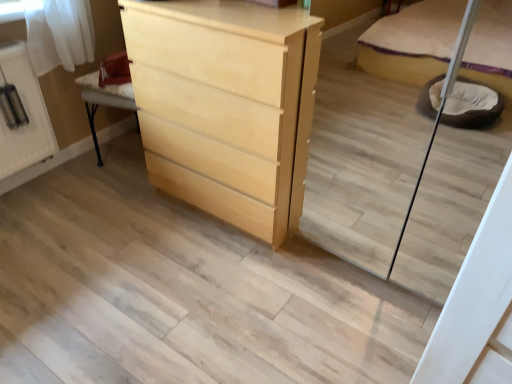
Question: Is white glossy cabinet at upper left looking in the opposite direction of light wood/finish chest of drawers at center?

Choices:
 (A) no
 (B) yes

Answer: (A)

Question: Can you confirm if white glossy cabinet at upper left is taller than light wood/finish chest of drawers at center?

Choices:
 (A) no
 (B) yes

Answer: (A)

Question: Considering the relative positions of white glossy cabinet at upper left and light wood/finish chest of drawers at center in the image provided, is white glossy cabinet at upper left to the left of light wood/finish chest of drawers at center from the viewer's perspective?

Choices:
 (A) no
 (B) yes

Answer: (B)

Question: Is white glossy cabinet at upper left to the right of light wood/finish chest of drawers at center from the viewer's perspective?

Choices:
 (A) yes
 (B) no

Answer: (B)

Question: Does white glossy cabinet at upper left have a lesser width compared to light wood/finish chest of drawers at center?

Choices:
 (A) yes
 (B) no

Answer: (A)

Question: Could you tell me if white glossy cabinet at upper left is turned towards light wood/finish chest of drawers at center?

Choices:
 (A) no
 (B) yes

Answer: (A)

Question: Considering the relative sizes of light wood/finish chest of drawers at center and white glossy cabinet at upper left in the image provided, is light wood/finish chest of drawers at center wider than white glossy cabinet at upper left?

Choices:
 (A) no
 (B) yes

Answer: (B)

Question: From the image's perspective, does light wood/finish chest of drawers at center appear higher than white glossy cabinet at upper left?

Choices:
 (A) yes
 (B) no

Answer: (B)

Question: Can you confirm if light wood/finish chest of drawers at center is positioned to the left of white glossy cabinet at upper left?

Choices:
 (A) no
 (B) yes

Answer: (A)

Question: Is light wood/finish chest of drawers at center at the right side of white glossy cabinet at upper left?

Choices:
 (A) yes
 (B) no

Answer: (A)

Question: Is light wood/finish chest of drawers at center aimed at white glossy cabinet at upper left?

Choices:
 (A) yes
 (B) no

Answer: (B)

Question: From a real-world perspective, is light wood/finish chest of drawers at center positioned under white glossy cabinet at upper left based on gravity?

Choices:
 (A) yes
 (B) no

Answer: (B)

Question: From a real-world perspective, is light wood/finish chest of drawers at center physically located above or below white glossy cabinet at upper left?

Choices:
 (A) below
 (B) above

Answer: (B)